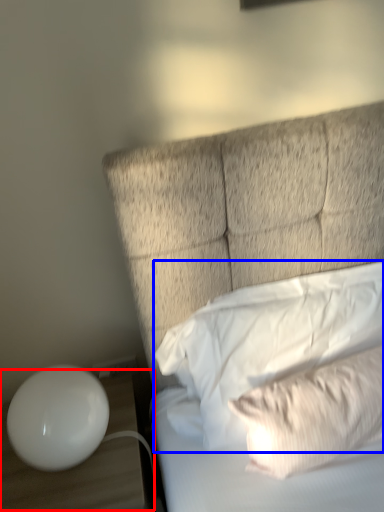
Question: Which point is further to the camera, table (highlighted by a red box) or pillow (highlighted by a blue box)?

Choices:
 (A) table
 (B) pillow

Answer: (A)